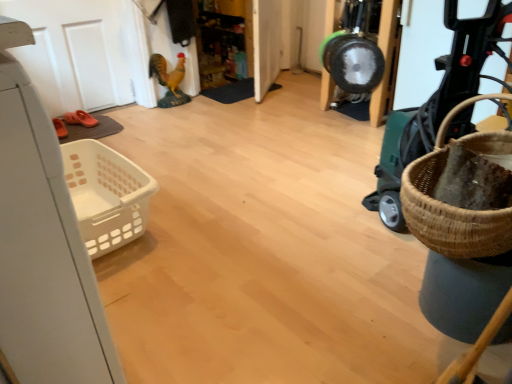
Locate an element on the screen. This screenshot has height=384, width=512. vacant space in front of shiny plastic rooster at upper center is located at coordinates (166, 115).